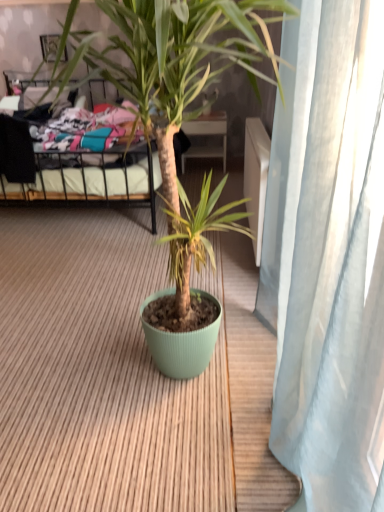
Question: From a real-world perspective, is metallic black bed at upper left above or below matte black picture frame at upper left?

Choices:
 (A) below
 (B) above

Answer: (A)

Question: Looking at their shapes, would you say metallic black bed at upper left is wider or thinner than matte black picture frame at upper left?

Choices:
 (A) wide
 (B) thin

Answer: (A)

Question: Which of these objects is positioned farthest from the matte green pot at center?

Choices:
 (A) metallic black bed at upper left
 (B) matte black picture frame at upper left

Answer: (A)

Question: Estimate the real-world distances between objects in this image. Which object is closer to the metallic black bed at upper left?

Choices:
 (A) matte black picture frame at upper left
 (B) matte green pot at center

Answer: (A)